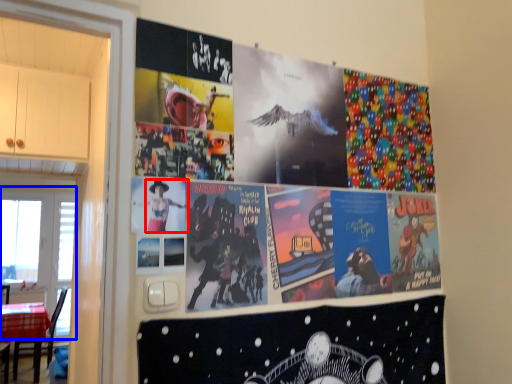
Question: Among these objects, which one is nearest to the camera, person (highlighted by a red box) or window screen (highlighted by a blue box)?

Choices:
 (A) person
 (B) window screen

Answer: (A)